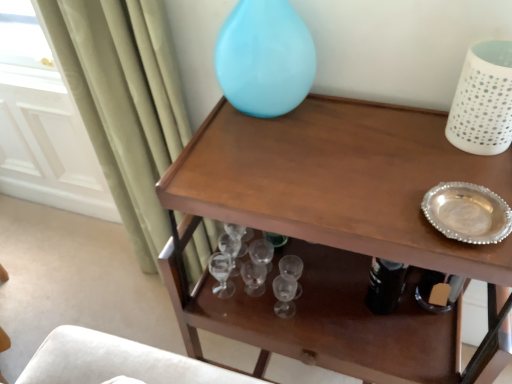
Where is `free region on the left part of white perforated vase at upper right, which is counted as the 1th vase, starting from the right`? This screenshot has height=384, width=512. free region on the left part of white perforated vase at upper right, which is counted as the 1th vase, starting from the right is located at coordinates (388, 146).